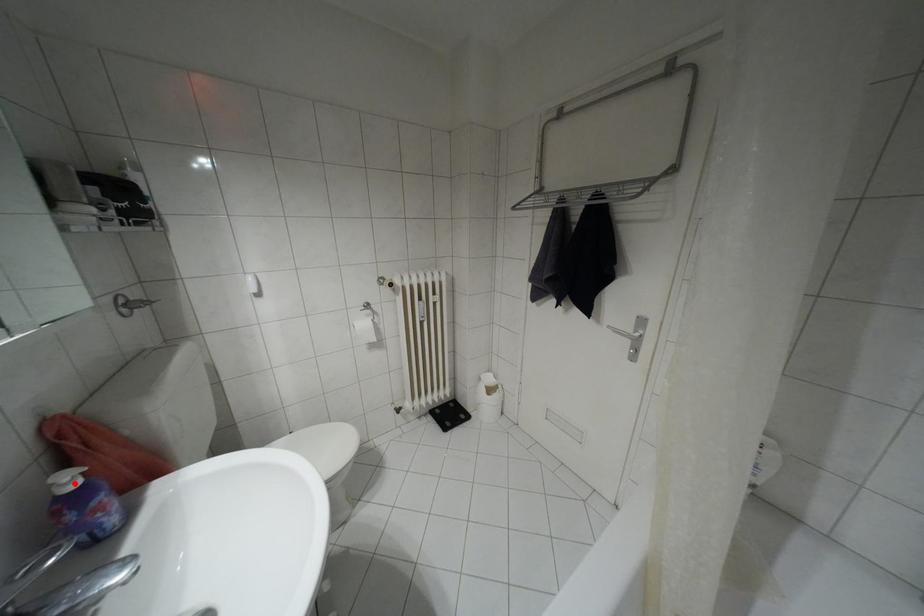
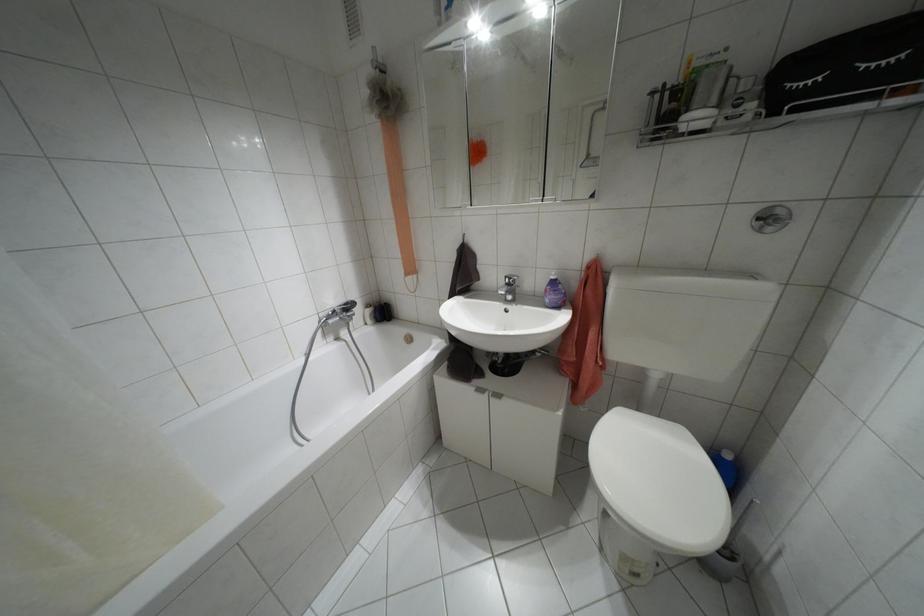
Where in the second image is the point corresponding to the highlighted location from the first image?

(552, 277)